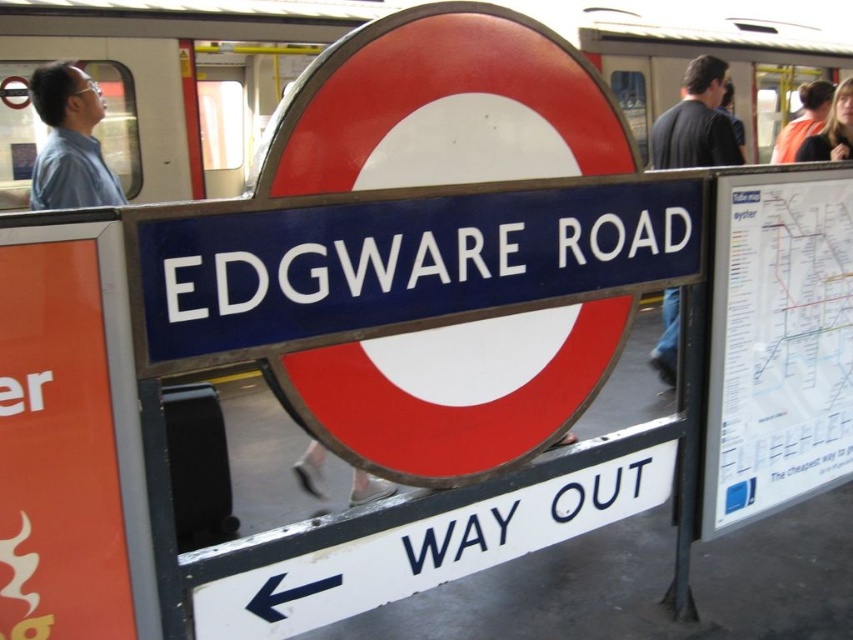
Which of these two, metallic blue sign at center or black shirt at right, stands shorter?

Standing shorter between the two is metallic blue sign at center.

Measure the distance between metallic blue sign at center and camera.

They are 5.02 feet apart.

Find the location of a particular element. This screenshot has height=640, width=853. metallic blue sign at center is located at coordinates (396, 262).

Between point (676, 308) and point (834, 128), which one is positioned in front?

Positioned in front is point (834, 128).

Is black shirt at right bigger than orange safety vest at upper right?

Yes.

Identify the location of black shirt at right. (695, 122).

Find the location of `black shirt at right`. black shirt at right is located at coordinates (695, 122).

Which is more to the right, white painted metal sign at lower center or orange safety vest at upper right?

orange safety vest at upper right is more to the right.

Is white painted metal sign at lower center thinner than orange safety vest at upper right?

No.

Who is more forward, [656,493] or [828,141]?

Point [656,493]

This screenshot has width=853, height=640. I want to click on white painted metal sign at lower center, so click(x=428, y=550).